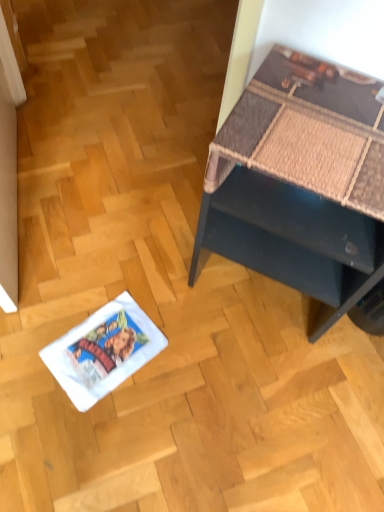
This screenshot has height=512, width=384. What are the coordinates of `empty space that is ontop of dark blue textured desk at upper right (from a real-world perspective)` in the screenshot? It's located at click(327, 115).